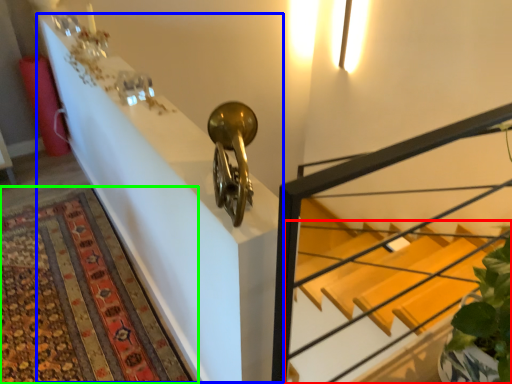
Question: Which object is positioned closest to stairs (highlighted by a red box)? Select from table (highlighted by a blue box) and mat (highlighted by a green box).

Choices:
 (A) table
 (B) mat

Answer: (B)